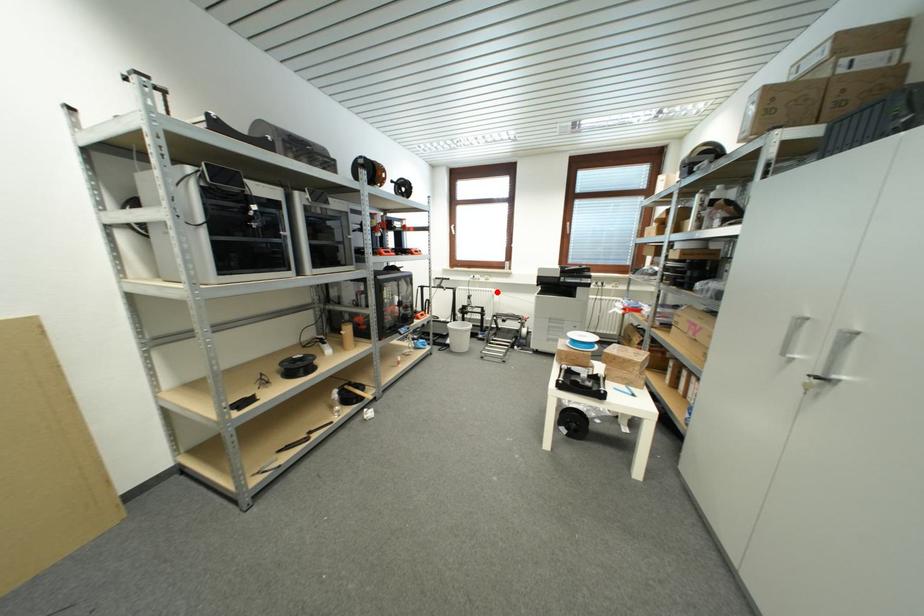
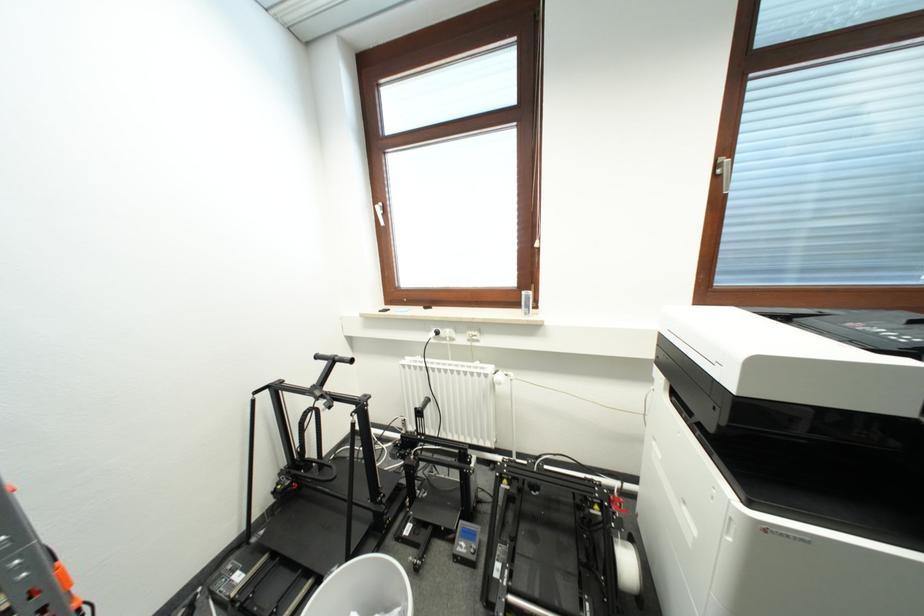
Find the pixel in the second image that matches the highlighted location in the first image.

(494, 371)